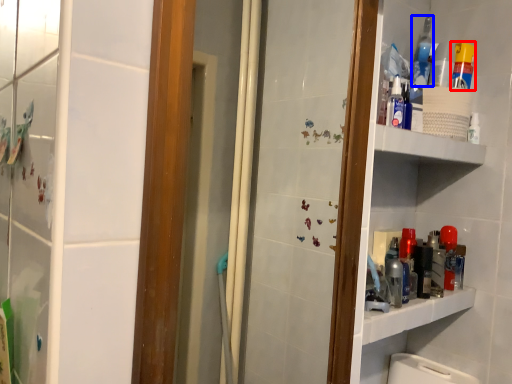
Question: Which point is further to the camera, cleaning product (highlighted by a red box) or mouthwash (highlighted by a blue box)?

Choices:
 (A) cleaning product
 (B) mouthwash

Answer: (B)